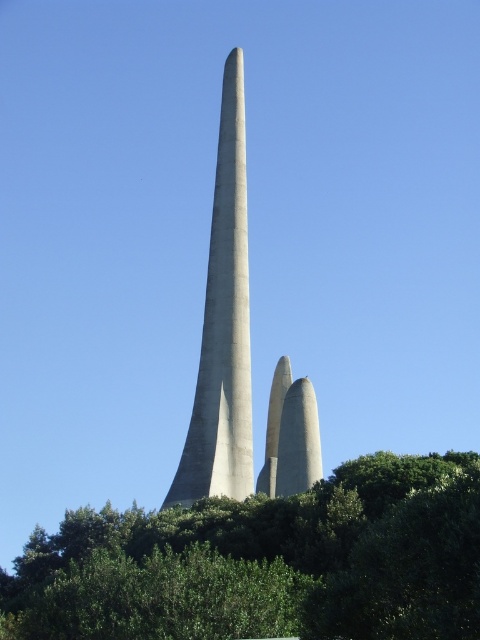
Question: Estimate the real-world distances between objects in this image. Which object is farther from the smooth concrete twin towers at center?

Choices:
 (A) green leafy tree at center
 (B) gray concrete tower at center

Answer: (A)

Question: Is gray concrete tower at center wider than smooth concrete twin towers at center?

Choices:
 (A) no
 (B) yes

Answer: (B)

Question: Among these points, which one is farthest from the camera?

Choices:
 (A) (321, 460)
 (B) (3, 595)
 (C) (235, 451)

Answer: (B)

Question: Can you confirm if green leafy tree at center is bigger than smooth concrete twin towers at center?

Choices:
 (A) no
 (B) yes

Answer: (B)

Question: Based on their relative distances, which object is farther from the smooth concrete twin towers at center?

Choices:
 (A) green leafy tree at center
 (B) gray concrete tower at center

Answer: (A)

Question: Does green leafy tree at center have a greater width compared to smooth concrete twin towers at center?

Choices:
 (A) yes
 (B) no

Answer: (A)